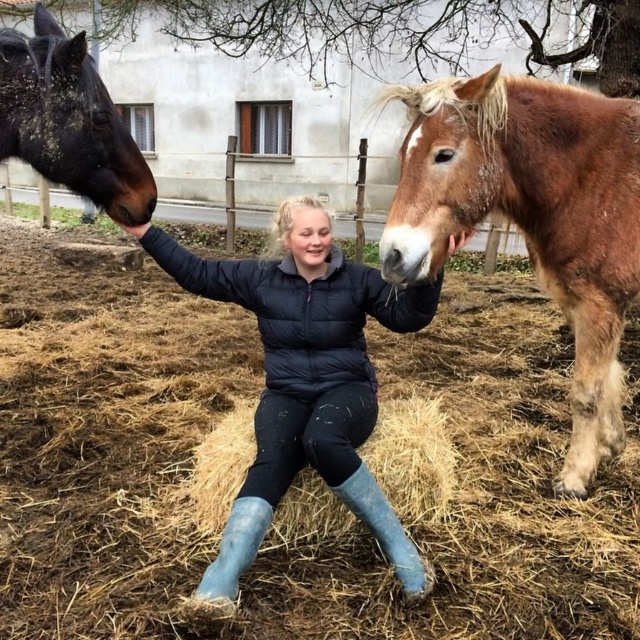
You are a farmer checking the space in your barn. You have a new horse that needs a place to rest. Looking at the image, can the shiny black horse at left be moved to the area currently occupied by the light brown straw at center without removing any other objects?

The shiny black horse at left occupies less space than light brown straw at center, so yes, the horse can be moved to the area occupied by the light brown straw at center since it requires less space.

Consider the image. You are a farmer who needs to determine the space required for the shiny black horse at left. Given that the light brown straw at center occupies 2 meters in width, can the horse fit in a 1.5 meter wide stall?

The shiny black horse at left is narrower than the light brown straw at center, which is 2 meters wide. Since the horse is less than 1.5 meters wide, it can fit comfortably in the 1.5 meter wide stall.

You are a photographer trying to capture the girl and the horses in a single shot. Since the brown fuzzy horse at upper right and the black matte jacket at center are both in your viewfinder, which one would you need to focus on first to ensure it is in sharp focus?

The brown fuzzy horse at upper right is positioned over the black matte jacket at center, so you should focus on the brown fuzzy horse at upper right first to ensure it is in sharp focus as it is closer to the camera.